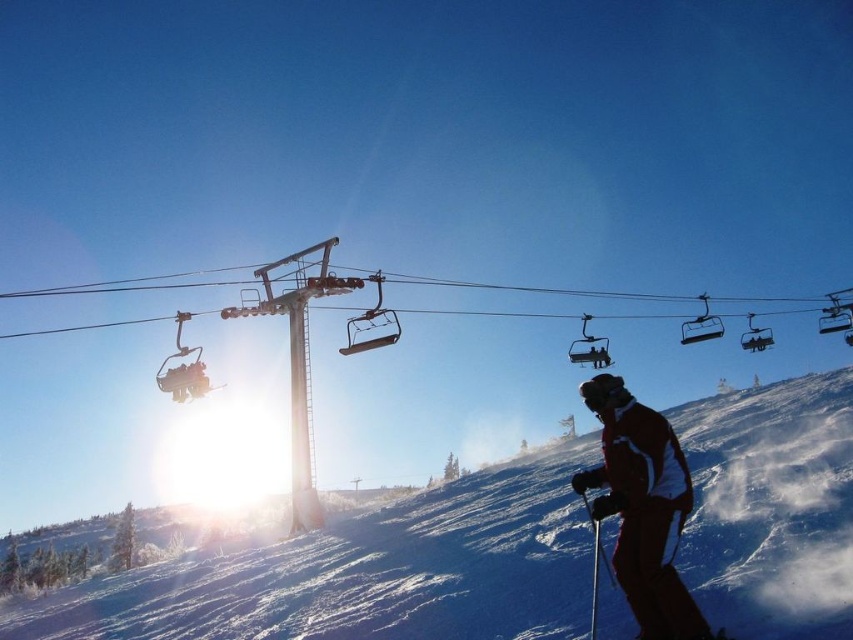
Between point (474, 579) and point (648, 576), which one is positioned in front?

Point (648, 576) is more forward.

Can you confirm if white powdery snow at center is wider than red ski suit at lower right?

Yes.

You are a GUI agent. You are given a task and a screenshot of the screen. Output one action in this format:
    pyautogui.click(x=<x>, y=<y>)
    Task: Click on the white powdery snow at center
    This screenshot has height=640, width=853.
    Given the screenshot: What is the action you would take?
    pyautogui.click(x=367, y=573)

Between point (820, 412) and point (576, 353), which one is positioned in front?

Positioned in front is point (820, 412).

Measure the distance from white powdery snow at center to metallic silver ski lift at upper center.

white powdery snow at center is 87.32 feet away from metallic silver ski lift at upper center.

This screenshot has height=640, width=853. I want to click on white powdery snow at center, so point(367,573).

Which is in front, point (631, 436) or point (577, 353)?

Point (631, 436) is more forward.

From the picture: Is red ski suit at lower right taller than metallic silver ski lift at upper center?

Yes.

Identify the location of red ski suit at lower right. (642, 508).